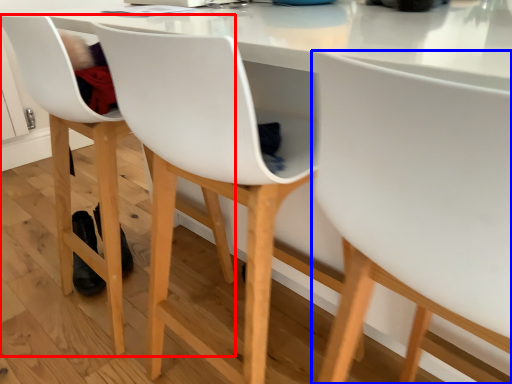
Question: Among these objects, which one is nearest to the camera, chair (highlighted by a red box) or chair (highlighted by a blue box)?

Choices:
 (A) chair
 (B) chair

Answer: (B)